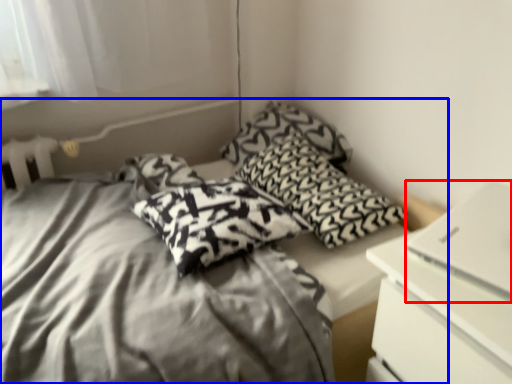
Question: Which of the following is the closest to the observer, computer (highlighted by a red box) or bed (highlighted by a blue box)?

Choices:
 (A) computer
 (B) bed

Answer: (B)